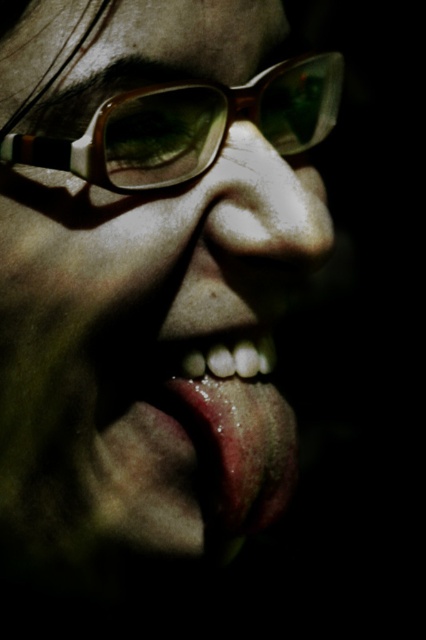
Who is more distant from viewer, (278, 241) or (163, 182)?

The point (278, 241) is more distant.

Does matte plastic glasses at upper center have a greater width compared to matte brown glasses at upper center?

Yes.

Measure the distance between point (86, 120) and camera.

16.75 inches

Where is `matte plastic glasses at upper center`? The height and width of the screenshot is (640, 426). matte plastic glasses at upper center is located at coordinates (152, 269).

Who is more distant from viewer, (245, 493) or (230, 140)?

Point (245, 493)

Based on the photo, who is more forward, (212, 385) or (284, 216)?

Point (284, 216) is in front.

The height and width of the screenshot is (640, 426). Find the location of `shiny pink lips at center`. shiny pink lips at center is located at coordinates (232, 426).

Looking at this image, who is positioned more to the right, matte brown glasses at upper center or shiny pink lips at center?

From the viewer's perspective, shiny pink lips at center appears more on the right side.

Which of these two, matte brown glasses at upper center or shiny pink lips at center, stands shorter?

shiny pink lips at center

Locate an element on the screen. matte brown glasses at upper center is located at coordinates (189, 125).